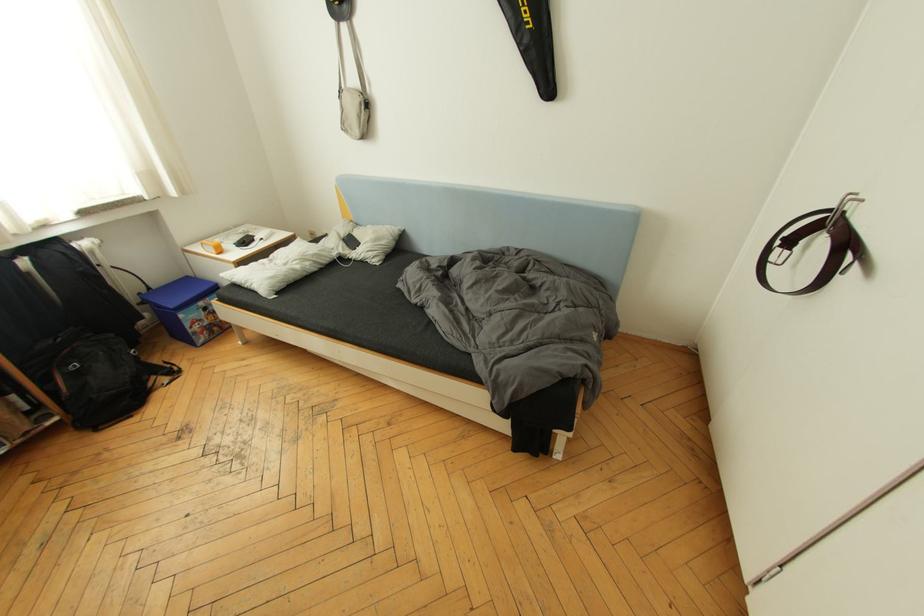
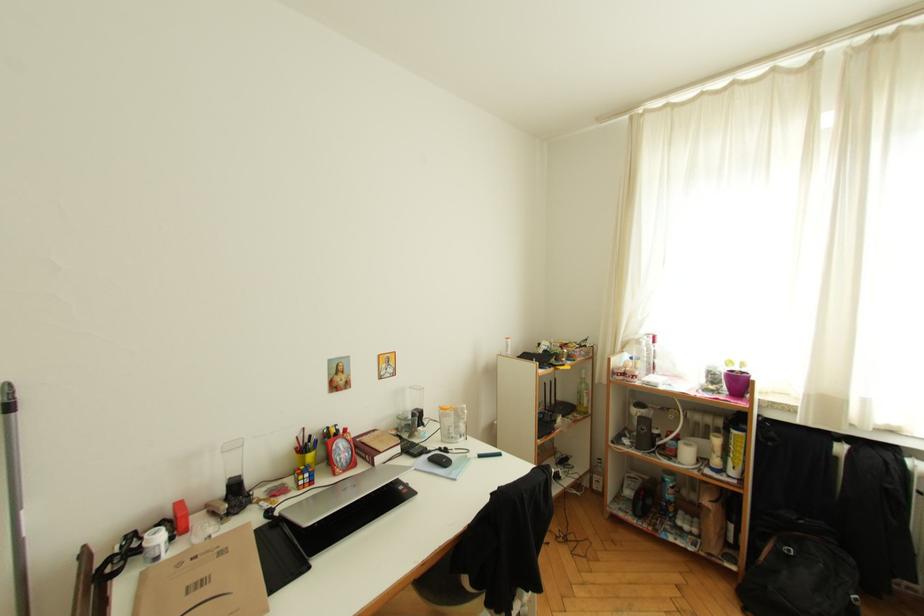
How did the camera likely rotate?

The rotation direction of the camera is left-down.